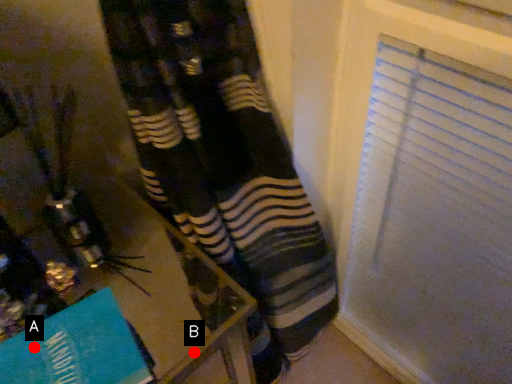
Question: Two points are circled on the image, labeled by A and B beside each circle. Which point is further to the camera?

Choices:
 (A) A is further
 (B) B is further

Answer: (B)